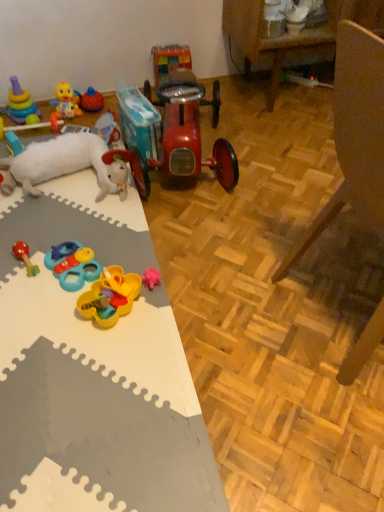
Find the location of a particular element. The image size is (384, 512). vacant region below wooden armchair at lower right (from a real-world perspective) is located at coordinates (340, 291).